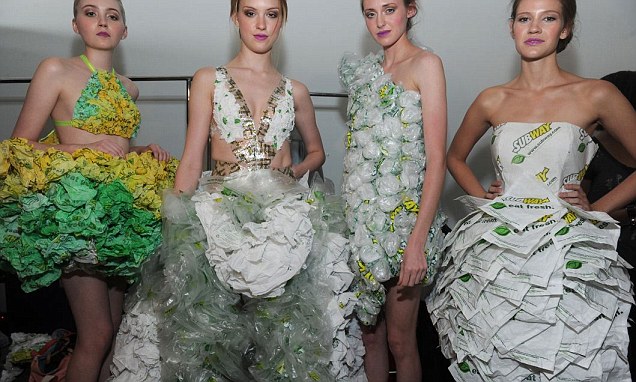
What are the coordinates of `wall` in the screenshot? It's located at tap(334, 41).